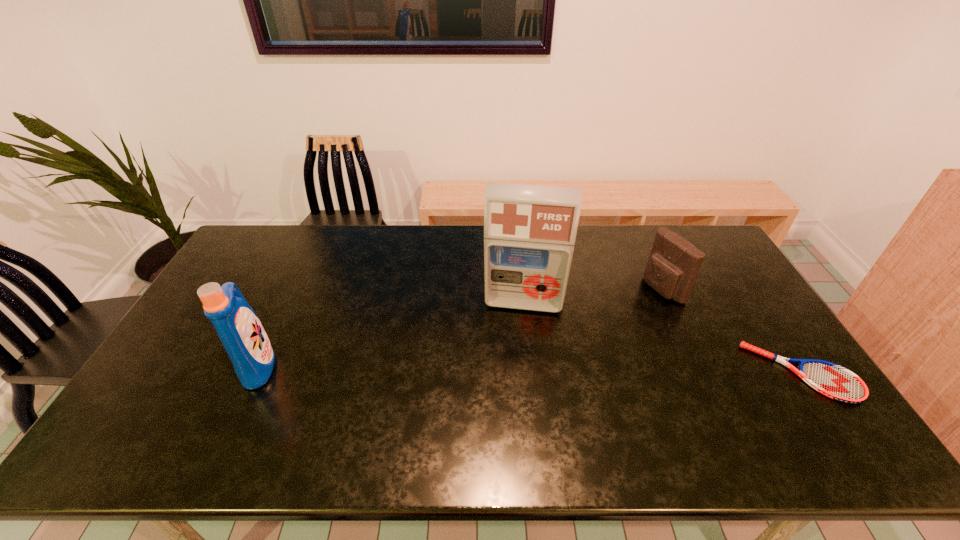
You are a GUI agent. You are given a task and a screenshot of the screen. Output one action in this format:
    pyautogui.click(x=<x>, y=<y>)
    Task: Click on the free space on the desktop that is between the third shortest object and the rightmost object and is positioned on the front-facing side of the first-aid kit
    The width and height of the screenshot is (960, 540).
    Given the screenshot: What is the action you would take?
    pyautogui.click(x=517, y=368)

Locate an element on the screen. Image resolution: width=960 pixels, height=540 pixels. vacant spot on the desktop that is between the third shortest object and the tennis racket and is positioned with an open flap on the third object from left to right is located at coordinates (492, 368).